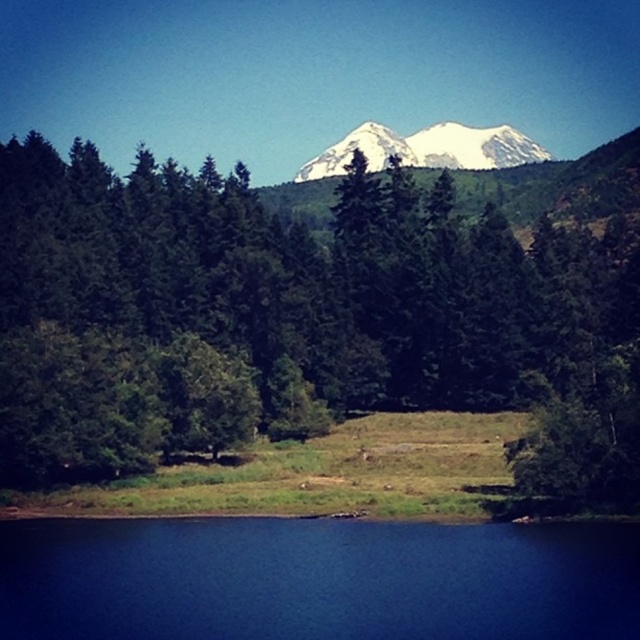
You are standing at the edge of the water and want to walk towards the snowy white mountain at upper center. Which direction should you walk to avoid the green matte tree at center?

To reach the snowy white mountain at upper center while avoiding the green matte tree at center, walk to the right since the tree is positioned to the left of the mountain.

Please check the coordinates provided. Is the point at (317, 308) indicating the green matte tree at center located within the water area or on the land?

The green matte tree at center is represented by point (317, 308), so the point is located on land where the tree stands.